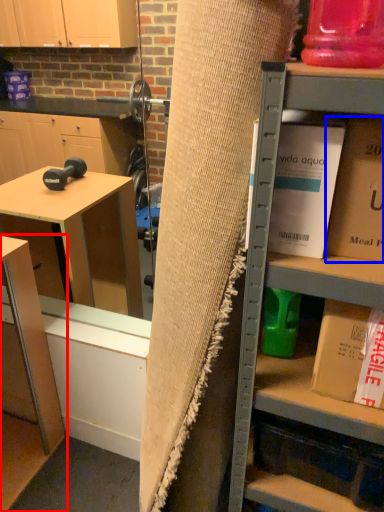
Question: Which of the following is the farthest to the observer, table (highlighted by a red box) or book (highlighted by a blue box)?

Choices:
 (A) table
 (B) book

Answer: (A)